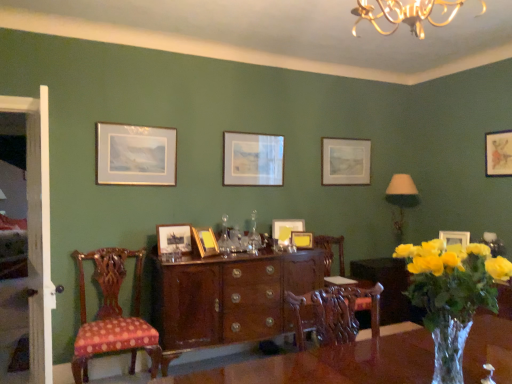
Question: Is wooden picture frame at center, positioned as the 7th picture frame in right-to-left order, to the right of white wooden door at left from the viewer's perspective?

Choices:
 (A) yes
 (B) no

Answer: (A)

Question: From the image's perspective, is wooden picture frame at center, positioned as the 7th picture frame in right-to-left order, above white wooden door at left?

Choices:
 (A) yes
 (B) no

Answer: (A)

Question: Is wooden picture frame at center, placed as the third picture frame when sorted from left to right, taller than white wooden door at left?

Choices:
 (A) no
 (B) yes

Answer: (A)

Question: Is the surface of wooden picture frame at center, positioned as the 7th picture frame in right-to-left order, in direct contact with white wooden door at left?

Choices:
 (A) yes
 (B) no

Answer: (B)

Question: Is wooden picture frame at center, positioned as the 7th picture frame in right-to-left order, positioned beyond the bounds of white wooden door at left?

Choices:
 (A) no
 (B) yes

Answer: (B)

Question: Is wooden picture frame at center, positioned as the 7th picture frame in right-to-left order, wider than white wooden door at left?

Choices:
 (A) no
 (B) yes

Answer: (A)

Question: Is the depth of matte silver picture frame at center, marked as the seventh picture frame in a left-to-right arrangement, greater than that of wooden picture frame at center, placed as the third picture frame when sorted from left to right?

Choices:
 (A) no
 (B) yes

Answer: (B)

Question: Does matte silver picture frame at center, the 3th picture frame when ordered from right to left, have a smaller size compared to wooden picture frame at center, placed as the third picture frame when sorted from left to right?

Choices:
 (A) yes
 (B) no

Answer: (B)

Question: Would you consider matte silver picture frame at center, marked as the seventh picture frame in a left-to-right arrangement, to be distant from wooden picture frame at center, positioned as the 7th picture frame in right-to-left order?

Choices:
 (A) yes
 (B) no

Answer: (A)

Question: Is matte silver picture frame at center, the 3th picture frame when ordered from right to left, located outside wooden picture frame at center, placed as the third picture frame when sorted from left to right?

Choices:
 (A) yes
 (B) no

Answer: (A)

Question: Is matte silver picture frame at center, the 3th picture frame when ordered from right to left, at the left side of wooden picture frame at center, positioned as the 7th picture frame in right-to-left order?

Choices:
 (A) no
 (B) yes

Answer: (A)

Question: Does matte silver picture frame at center, the 3th picture frame when ordered from right to left, have a lesser height compared to wooden picture frame at center, positioned as the 7th picture frame in right-to-left order?

Choices:
 (A) no
 (B) yes

Answer: (A)

Question: Considering the relative sizes of yellow matte picture frame at center, acting as the 5th picture frame starting from the left, and matte gold picture frame at upper right, the 8th picture frame from the left, in the image provided, is yellow matte picture frame at center, acting as the 5th picture frame starting from the left, thinner than matte gold picture frame at upper right, the 8th picture frame from the left,?

Choices:
 (A) yes
 (B) no

Answer: (B)